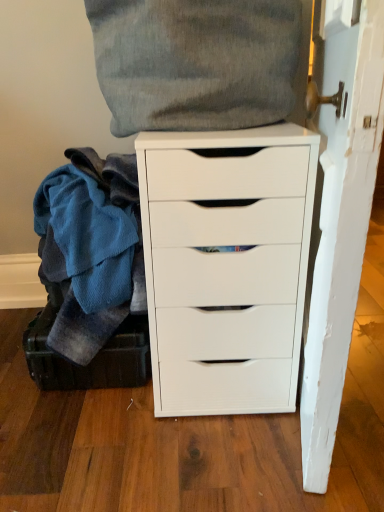
Question: Are blue fleece blanket at left, the second clothing in the top-to-bottom sequence, and dark green leather suitcase at lower left making contact?

Choices:
 (A) no
 (B) yes

Answer: (A)

Question: Is blue fleece blanket at left, the first clothing from the bottom, further to the viewer compared to dark green leather suitcase at lower left?

Choices:
 (A) no
 (B) yes

Answer: (A)

Question: From the image's perspective, is blue fleece blanket at left, the second clothing in the top-to-bottom sequence, over dark green leather suitcase at lower left?

Choices:
 (A) yes
 (B) no

Answer: (A)

Question: From a real-world perspective, is blue fleece blanket at left, the first clothing from the bottom, located higher than dark green leather suitcase at lower left?

Choices:
 (A) yes
 (B) no

Answer: (A)

Question: Is blue fleece blanket at left, the first clothing from the bottom, far from dark green leather suitcase at lower left?

Choices:
 (A) no
 (B) yes

Answer: (A)

Question: From the image's perspective, is soft gray fabric pillow at upper center, the 2th clothing positioned from the bottom, above or below dark green leather suitcase at lower left?

Choices:
 (A) above
 (B) below

Answer: (A)

Question: Looking at their shapes, would you say soft gray fabric pillow at upper center, the 2th clothing positioned from the bottom, is wider or thinner than dark green leather suitcase at lower left?

Choices:
 (A) wide
 (B) thin

Answer: (B)

Question: From a real-world perspective, relative to dark green leather suitcase at lower left, is soft gray fabric pillow at upper center, the 2th clothing positioned from the bottom, vertically above or below?

Choices:
 (A) above
 (B) below

Answer: (A)

Question: Would you say soft gray fabric pillow at upper center, the 2th clothing positioned from the bottom, is to the left or to the right of dark green leather suitcase at lower left in the picture?

Choices:
 (A) right
 (B) left

Answer: (A)

Question: Is blue fleece blanket at left, the first clothing from the bottom, wider or thinner than white matte chest of drawers at center?

Choices:
 (A) thin
 (B) wide

Answer: (A)

Question: Relative to white matte chest of drawers at center, is blue fleece blanket at left, the first clothing from the bottom, in front or behind?

Choices:
 (A) front
 (B) behind

Answer: (B)

Question: Would you say blue fleece blanket at left, the second clothing in the top-to-bottom sequence, is inside or outside white matte chest of drawers at center?

Choices:
 (A) inside
 (B) outside

Answer: (B)

Question: In terms of size, does blue fleece blanket at left, the second clothing in the top-to-bottom sequence, appear bigger or smaller than white matte chest of drawers at center?

Choices:
 (A) small
 (B) big

Answer: (A)

Question: Based on their positions, is dark green leather suitcase at lower left located to the left or right of blue fleece blanket at left, the second clothing in the top-to-bottom sequence?

Choices:
 (A) right
 (B) left

Answer: (A)

Question: Considering their positions, is dark green leather suitcase at lower left located in front of or behind blue fleece blanket at left, the second clothing in the top-to-bottom sequence?

Choices:
 (A) behind
 (B) front

Answer: (A)